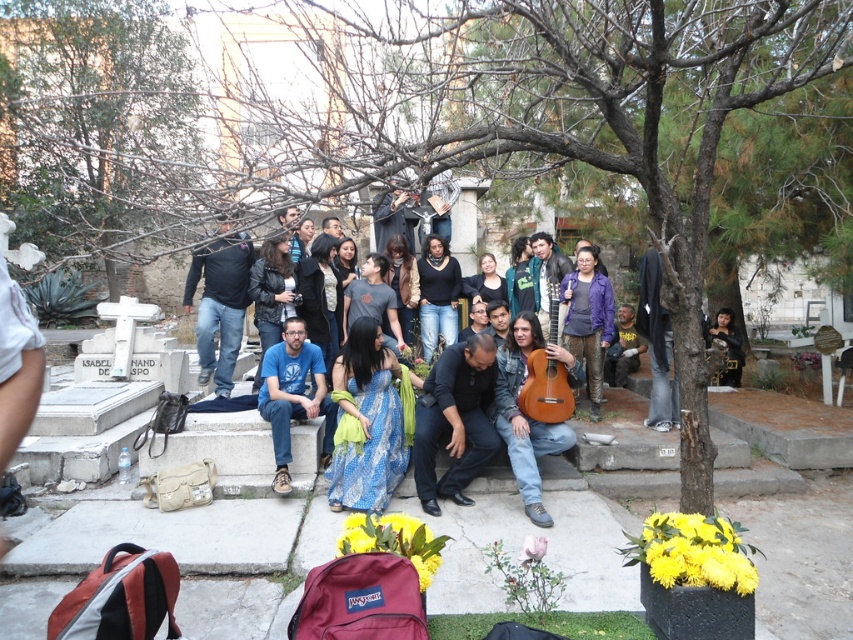
Question: Which of these objects is positioned closest to the purple metallic guitar at center?

Choices:
 (A) black matte pants at center
 (B) brown leafless branches at upper left

Answer: (A)

Question: Which of the following is the closest to the observer?

Choices:
 (A) (521, 364)
 (B) (357, 408)

Answer: (B)

Question: Is black matte jacket at center above black leather jacket at lower right?

Choices:
 (A) yes
 (B) no

Answer: (A)

Question: Does brown leafless branches at upper left appear on the right side of black leather jacket at lower right?

Choices:
 (A) no
 (B) yes

Answer: (A)

Question: Which point is closer to the camera taking this photo?

Choices:
 (A) (352, 346)
 (B) (595, 340)
 (C) (457, 364)
 (D) (721, 317)

Answer: (C)

Question: Is blue batik dress at center further to camera compared to purple metallic guitar at center?

Choices:
 (A) no
 (B) yes

Answer: (A)